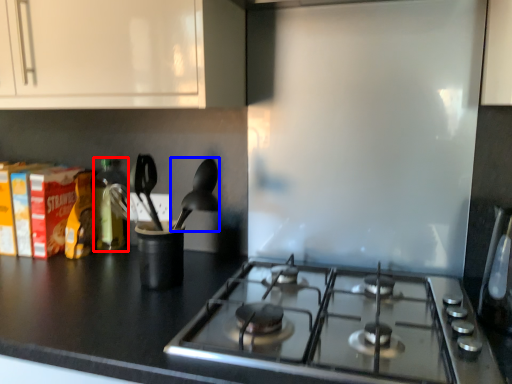
Question: Which point is closer to the camera, bottle (highlighted by a red box) or silverware (highlighted by a blue box)?

Choices:
 (A) bottle
 (B) silverware

Answer: (B)